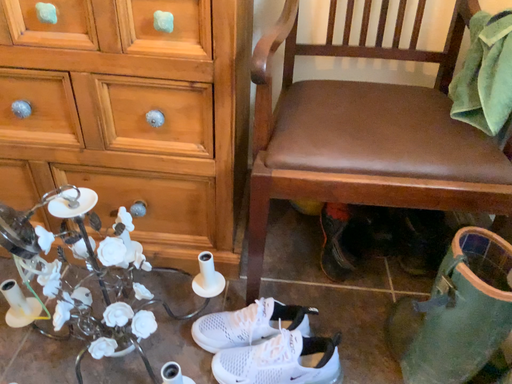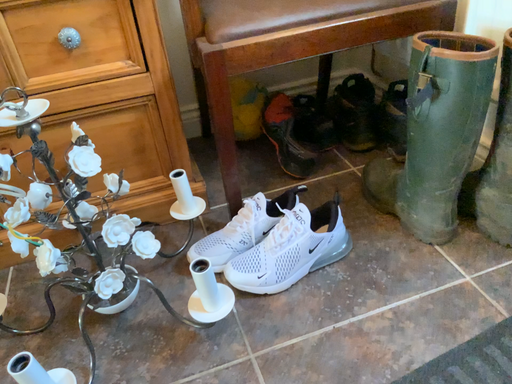
Question: How did the camera likely rotate when shooting the video?

Choices:
 (A) rotated right
 (B) rotated left

Answer: (A)